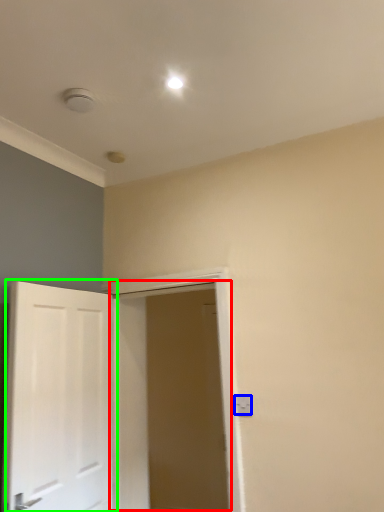
Question: Which object is the farthest from door (highlighted by a red box)? Choose among these: electric outlet (highlighted by a blue box) or door (highlighted by a green box).

Choices:
 (A) electric outlet
 (B) door

Answer: (A)